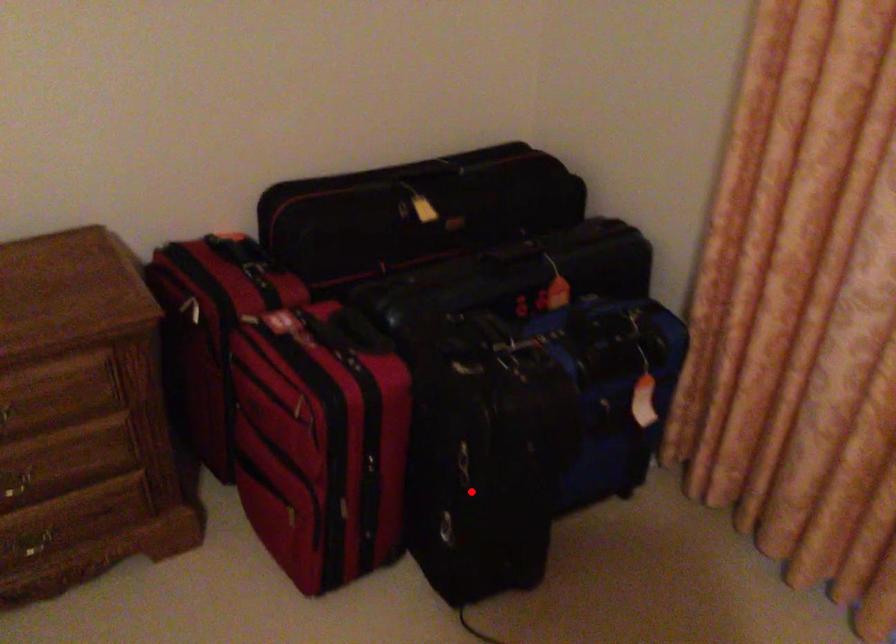
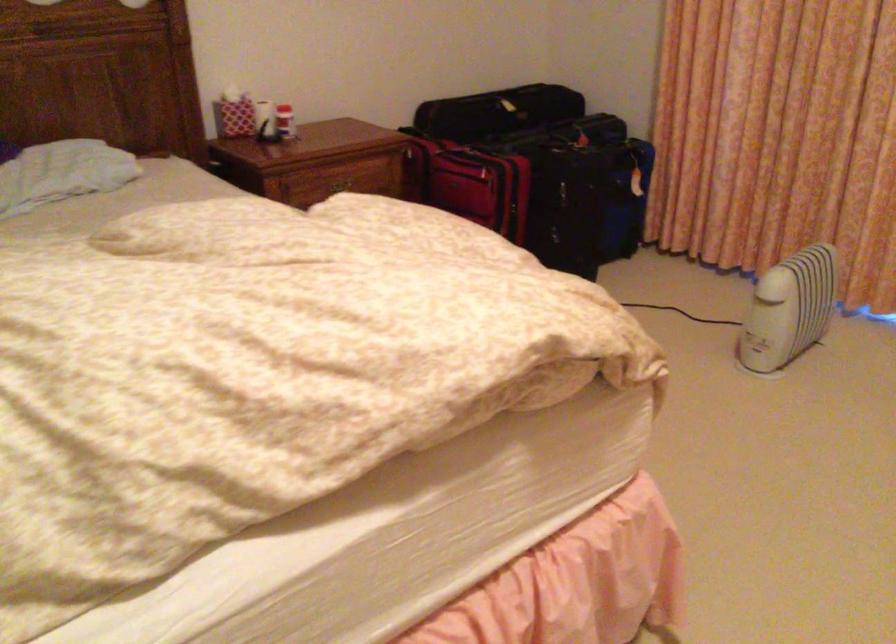
Question: I am providing you with two images of the same scene from different viewpoints. Given a red point in image1, look at the same physical point in image2. Is it:

Choices:
 (A) Closer to the viewpoint
 (B) Farther from the viewpoint

Answer: (B)